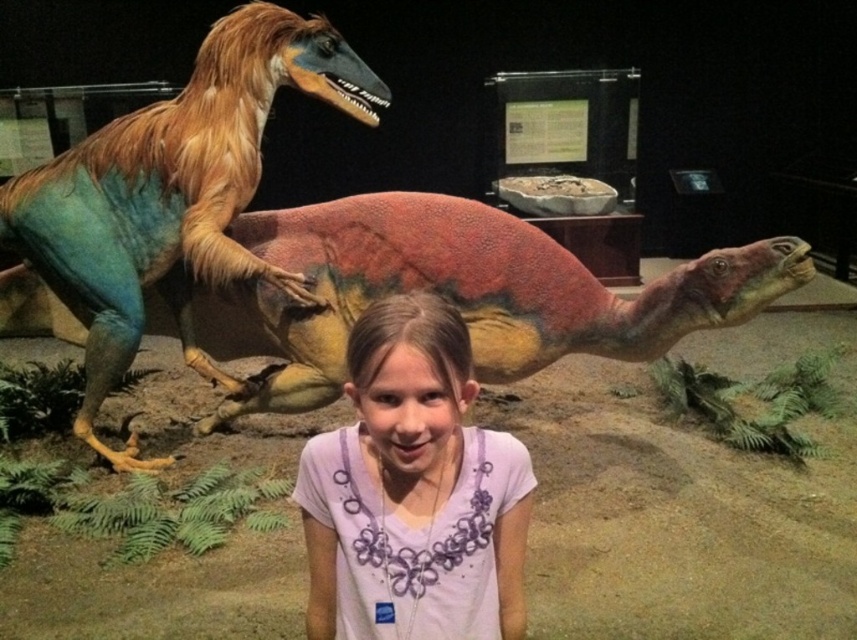
Does multicolored textured dinosaur at center have a lesser height compared to multicolored glossy dinosaur at left?

Yes.

Locate an element on the screen. multicolored textured dinosaur at center is located at coordinates (460, 292).

Does multicolored textured dinosaur at center have a lesser height compared to purple cotton shirt at center?

No, multicolored textured dinosaur at center is not shorter than purple cotton shirt at center.

You are a GUI agent. You are given a task and a screenshot of the screen. Output one action in this format:
    pyautogui.click(x=<x>, y=<y>)
    Task: Click on the multicolored textured dinosaur at center
    The image size is (857, 640).
    Given the screenshot: What is the action you would take?
    pyautogui.click(x=460, y=292)

I want to click on multicolored textured dinosaur at center, so coord(460,292).

Can you confirm if multicolored glossy dinosaur at left is positioned to the right of purple cotton shirt at center?

In fact, multicolored glossy dinosaur at left is to the left of purple cotton shirt at center.

Which is in front, point (82, 404) or point (423, 340)?

Positioned in front is point (423, 340).

Describe the element at coordinates (174, 195) in the screenshot. I see `multicolored glossy dinosaur at left` at that location.

This screenshot has width=857, height=640. In order to click on multicolored glossy dinosaur at left in this screenshot , I will do tap(174, 195).